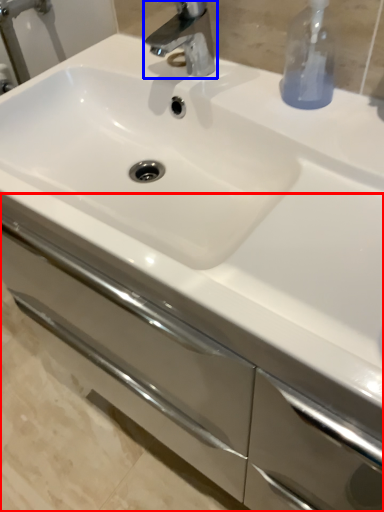
Question: Which point is further to the camera, bathroom cabinet (highlighted by a red box) or tap (highlighted by a blue box)?

Choices:
 (A) bathroom cabinet
 (B) tap

Answer: (B)